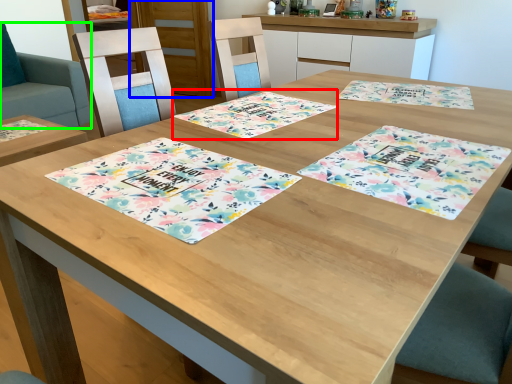
Question: Which object is positioned closest to place mat (highlighted by a red box)? Select from cabinetry (highlighted by a blue box) and swivel chair (highlighted by a green box).

Choices:
 (A) cabinetry
 (B) swivel chair

Answer: (B)